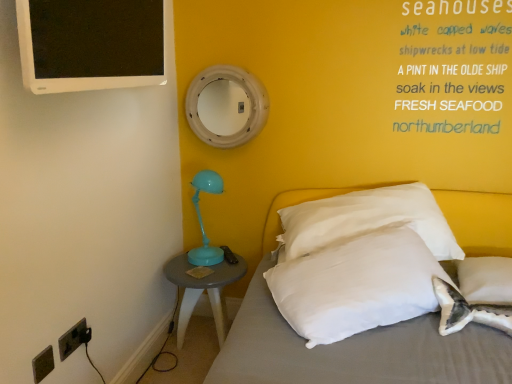
Question: From the image's perspective, is white fabric bed at lower right positioned above or below white painted wood mirror at upper center?

Choices:
 (A) below
 (B) above

Answer: (A)

Question: Is white fabric bed at lower right taller or shorter than white painted wood mirror at upper center?

Choices:
 (A) tall
 (B) short

Answer: (A)

Question: Which of these objects is positioned closest to the white painted wood mirror at upper center?

Choices:
 (A) white glossy computer monitor at upper left
 (B) dark gray plastic outlet at lower left, the second electric outlet positioned from the back
 (C) white soft pillow at center, the first pillow viewed from the left
 (D) matte gray side table at lower left
 (E) white fabric bed at lower right

Answer: (A)

Question: Estimate the real-world distances between objects in this image. Which object is farther from the white soft pillow at right, which ranks as the second pillow in left-to-right order?

Choices:
 (A) dark gray plastic outlet at lower left, the first electric outlet when ordered from front to back
 (B) white painted wood mirror at upper center
 (C) white soft pillow at center, the first pillow viewed from the left
 (D) black plastic electrical outlet at lower left, placed as the 2th electric outlet when sorted from front to back
 (E) matte gray side table at lower left

Answer: (A)